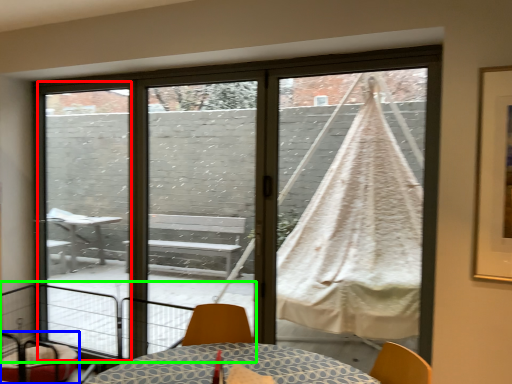
Question: Which is nearer to the screen door (highlighted by a red box)? furniture (highlighted by a blue box) or balcony (highlighted by a green box).

Choices:
 (A) furniture
 (B) balcony

Answer: (B)